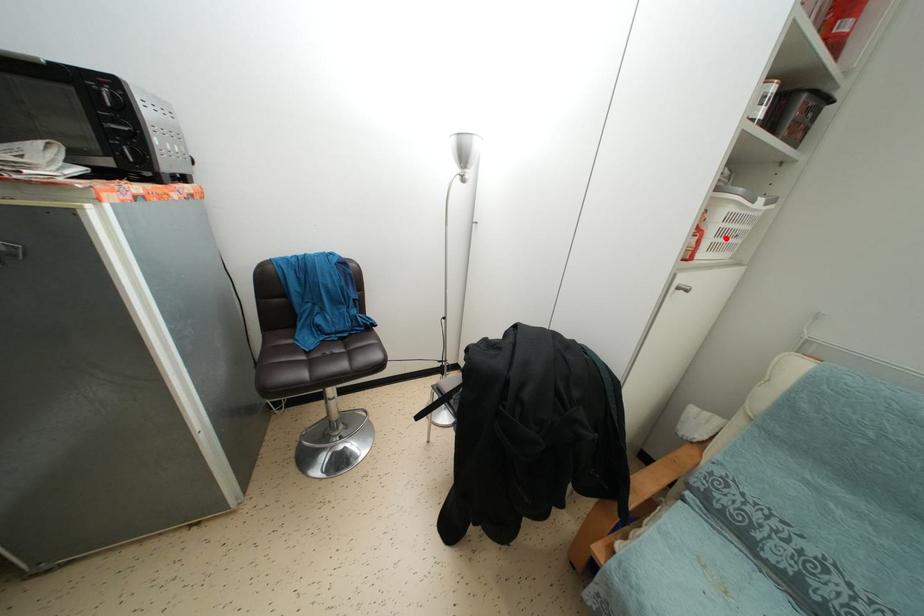
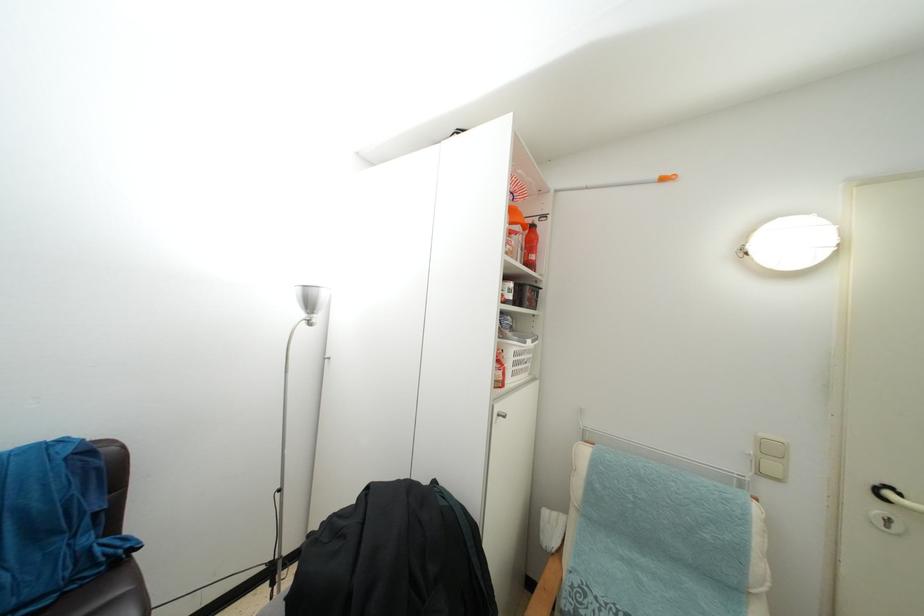
Question: I am providing you with two images of the same scene from different viewpoints. A red point is marked on the first image. Is the red point's position out of view in image 2?

Choices:
 (A) Yes
 (B) No

Answer: (B)